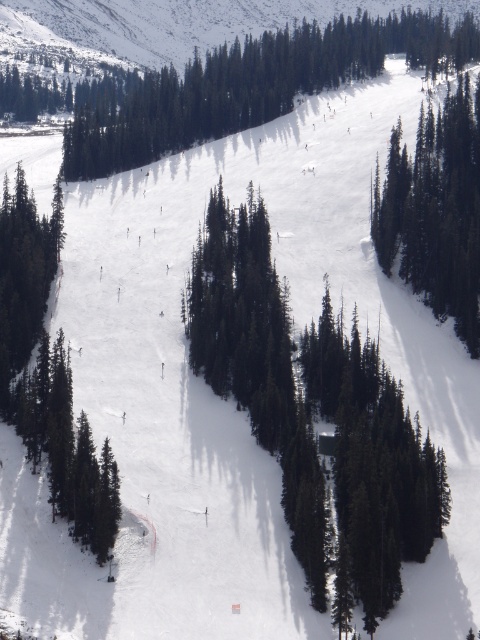
Question: Which point appears farthest from the camera in this image?

Choices:
 (A) (157, 74)
 (B) (37, 262)

Answer: (A)

Question: Is green coniferous trees at upper center above green matte tree at lower left?

Choices:
 (A) yes
 (B) no

Answer: (A)

Question: Which point is farther from the camera taking this photo?

Choices:
 (A) pyautogui.click(x=32, y=396)
 (B) pyautogui.click(x=478, y=118)
 (C) pyautogui.click(x=408, y=538)
 (D) pyautogui.click(x=60, y=241)

Answer: (B)

Question: Estimate the real-world distances between objects in this image. Which object is farther from the green coniferous trees at upper center?

Choices:
 (A) green matte tree at left
 (B) green matte tree at lower left
 (C) green coniferous trees at center
 (D) green matte tree at center-right

Answer: (B)

Question: Does green coniferous trees at center have a greater width compared to green matte tree at left?

Choices:
 (A) yes
 (B) no

Answer: (A)

Question: Does green coniferous trees at center appear under green matte tree at lower left?

Choices:
 (A) yes
 (B) no

Answer: (B)